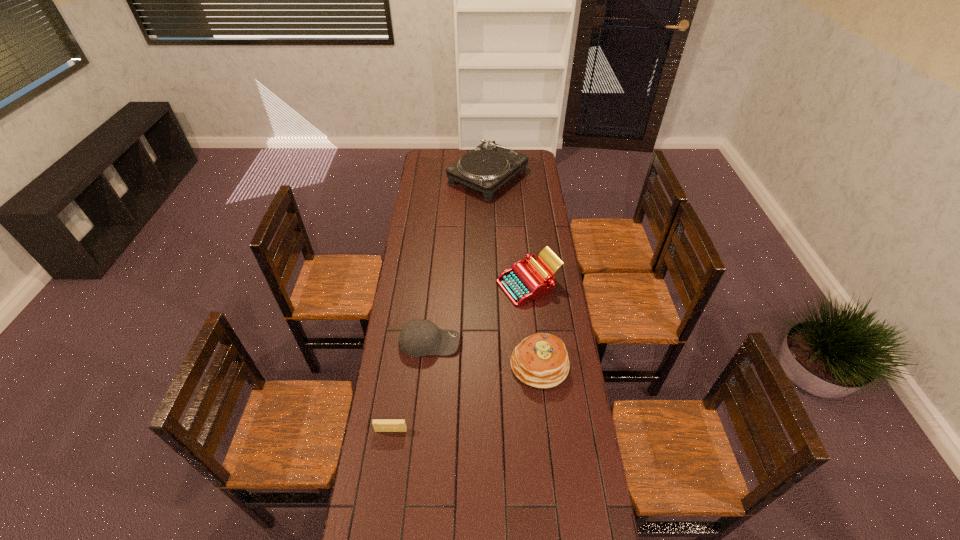
In order to click on free space at the left edge of the desktop in this screenshot , I will do `click(389, 493)`.

The width and height of the screenshot is (960, 540). In the image, there is a desktop. In order to click on free space at the right edge in this screenshot , I will do `click(541, 325)`.

At what (x,y) coordinates should I click in order to perform the action: click on free space between the nearest object and the pancake. Please return your answer as a coordinate pair (x, y). This screenshot has height=540, width=960. Looking at the image, I should click on (466, 397).

Where is `free spot between the shortest object and the second farthest object`? free spot between the shortest object and the second farthest object is located at coordinates (460, 357).

Locate an element on the screen. The width and height of the screenshot is (960, 540). vacant space in between the baseball cap and the pancake is located at coordinates (485, 353).

Find the location of a particular element. Image resolution: width=960 pixels, height=540 pixels. blank region between the fourth nearest object and the videotape is located at coordinates (460, 357).

Locate an element on the screen. free space between the farthest object and the baseball cap is located at coordinates (459, 259).

Locate an element on the screen. Image resolution: width=960 pixels, height=540 pixels. vacant region between the nearest object and the typewriter is located at coordinates coord(460,357).

Find the location of a particular element. The height and width of the screenshot is (540, 960). vacant area that lies between the shortest object and the pancake is located at coordinates (466, 397).

In order to click on empty space between the farthest object and the typewriter in this screenshot , I will do `click(508, 231)`.